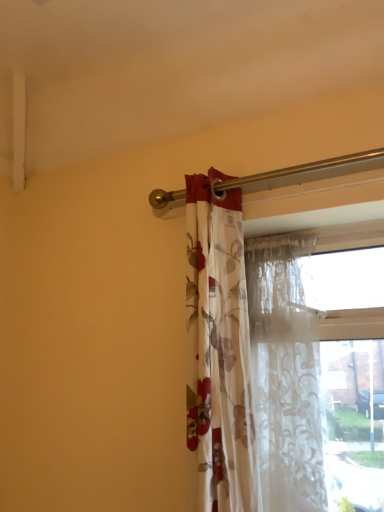
Question: From a real-world perspective, is floral fabric curtain at center, placed as the 1th curtain when sorted from left to right, physically above translucent floral fabric at center, arranged as the second curtain when viewed from the left?

Choices:
 (A) yes
 (B) no

Answer: (A)

Question: Considering the relative positions of floral fabric curtain at center, placed as the 1th curtain when sorted from left to right, and translucent floral fabric at center, arranged as the second curtain when viewed from the left, in the image provided, is floral fabric curtain at center, placed as the 1th curtain when sorted from left to right, behind translucent floral fabric at center, arranged as the second curtain when viewed from the left,?

Choices:
 (A) no
 (B) yes

Answer: (A)

Question: From the image's perspective, is floral fabric curtain at center, the second curtain from the right, above translucent floral fabric at center, arranged as the second curtain when viewed from the left?

Choices:
 (A) no
 (B) yes

Answer: (B)

Question: From the image's perspective, is floral fabric curtain at center, the second curtain from the right, beneath translucent floral fabric at center, acting as the 1th curtain starting from the right?

Choices:
 (A) yes
 (B) no

Answer: (B)

Question: Would you say floral fabric curtain at center, placed as the 1th curtain when sorted from left to right, is a long distance from translucent floral fabric at center, acting as the 1th curtain starting from the right?

Choices:
 (A) no
 (B) yes

Answer: (A)

Question: Does floral fabric curtain at center, the second curtain from the right, contain translucent floral fabric at center, arranged as the second curtain when viewed from the left?

Choices:
 (A) no
 (B) yes

Answer: (A)

Question: Is translucent floral fabric at center, acting as the 1th curtain starting from the right, not inside floral fabric curtain at center, placed as the 1th curtain when sorted from left to right?

Choices:
 (A) yes
 (B) no

Answer: (A)

Question: From the image's perspective, is translucent floral fabric at center, acting as the 1th curtain starting from the right, above floral fabric curtain at center, placed as the 1th curtain when sorted from left to right?

Choices:
 (A) yes
 (B) no

Answer: (B)

Question: Does translucent floral fabric at center, acting as the 1th curtain starting from the right, have a lesser height compared to floral fabric curtain at center, the second curtain from the right?

Choices:
 (A) yes
 (B) no

Answer: (A)

Question: Can you confirm if translucent floral fabric at center, acting as the 1th curtain starting from the right, is smaller than floral fabric curtain at center, placed as the 1th curtain when sorted from left to right?

Choices:
 (A) no
 (B) yes

Answer: (B)

Question: From a real-world perspective, is translucent floral fabric at center, arranged as the second curtain when viewed from the left, located higher than floral fabric curtain at center, placed as the 1th curtain when sorted from left to right?

Choices:
 (A) no
 (B) yes

Answer: (A)

Question: Does translucent floral fabric at center, acting as the 1th curtain starting from the right, have a greater width compared to floral fabric curtain at center, placed as the 1th curtain when sorted from left to right?

Choices:
 (A) no
 (B) yes

Answer: (A)

Question: Does point (233, 399) appear closer or farther from the camera than point (312, 498)?

Choices:
 (A) closer
 (B) farther

Answer: (A)